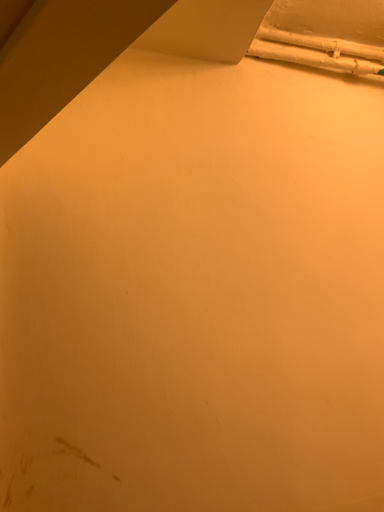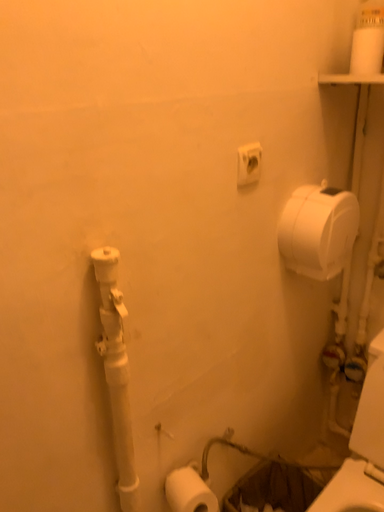
Question: Which way did the camera rotate in the video?

Choices:
 (A) rotated upward
 (B) rotated downward

Answer: (B)